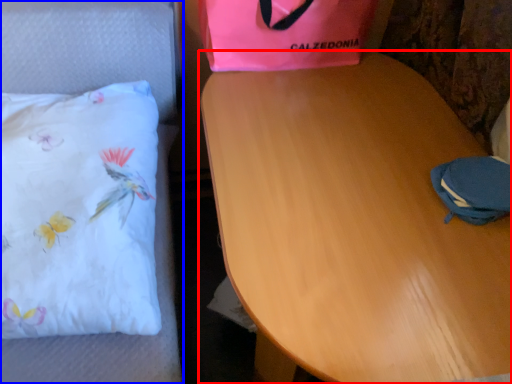
Question: Among these objects, which one is farthest to the camera, table (highlighted by a red box) or furniture (highlighted by a blue box)?

Choices:
 (A) table
 (B) furniture

Answer: (B)